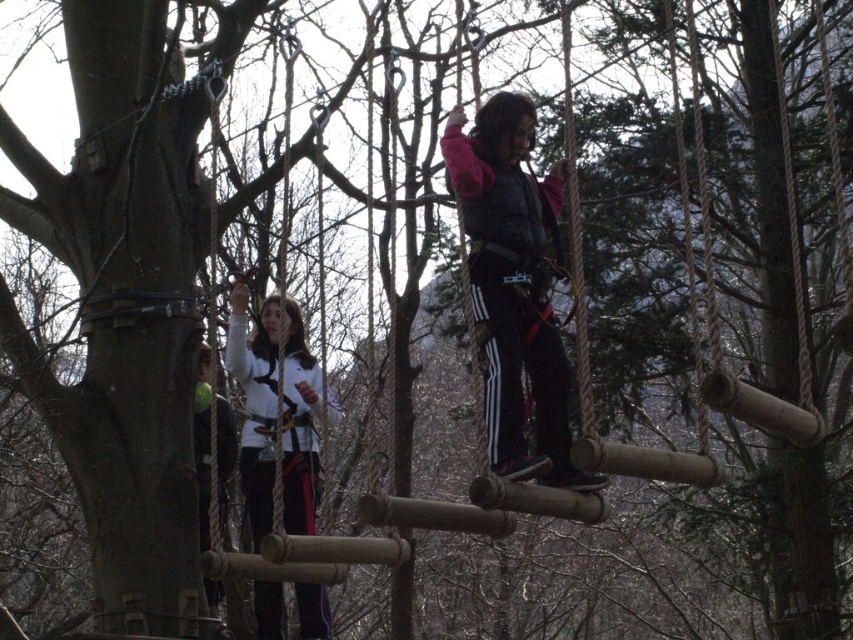
You see two people on the rope bridge in the wooded area. The first person is wearing a white matte jacket at center, and the second is wearing a white fabric jacket at center. From the perspective of someone standing on the left end of the bridge, which jacket is closer to the right side?

The white matte jacket at center is to the right of the white fabric jacket at center, so from the left end perspective, the white matte jacket at center is closer to the right side.

You are an observer standing on the ground looking at the two people on the rope bridge. Which person is closer to you, the one wearing the black matte pants at center or the one in the white matte jacket at center?

The black matte pants at center is closer to the viewer than the white matte jacket at center.